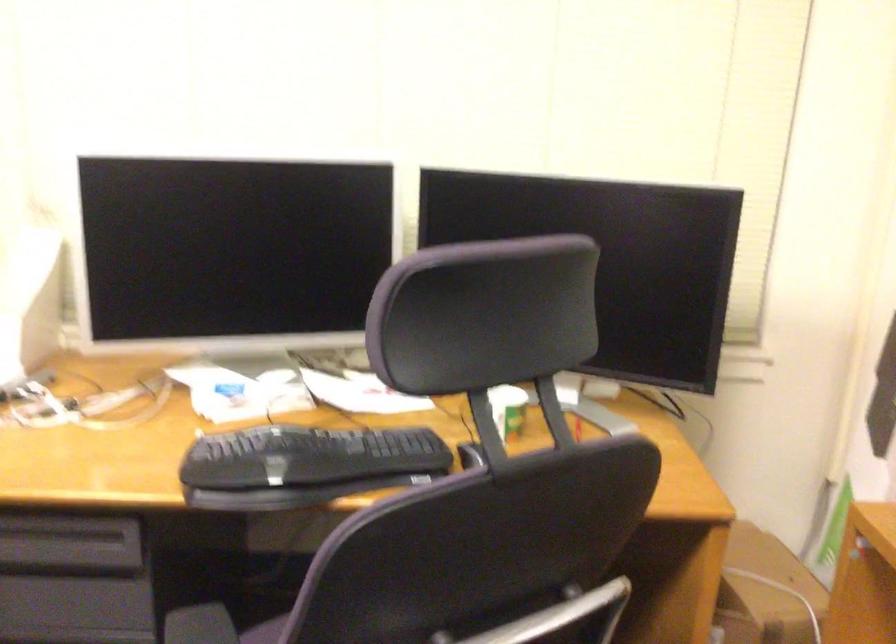
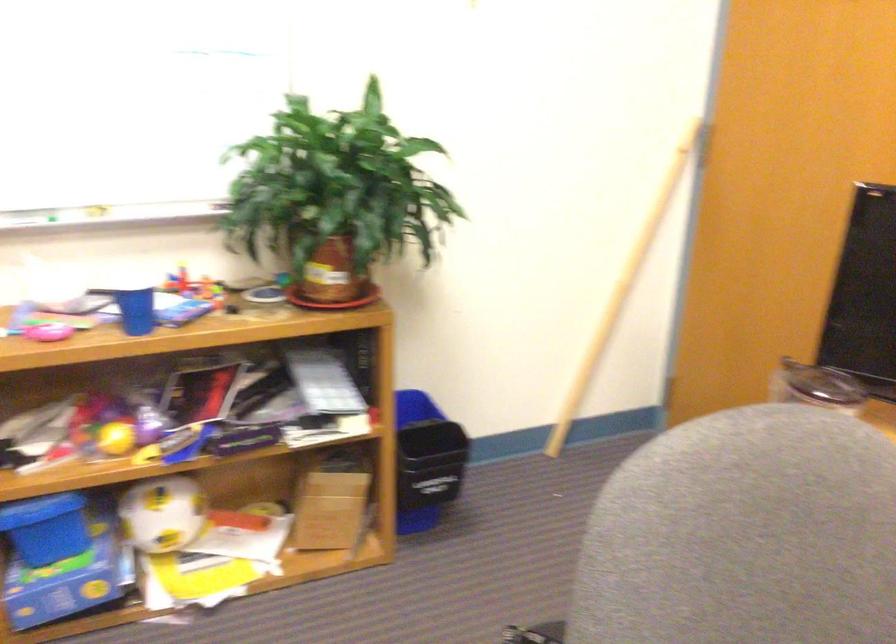
First-person continuous shooting, in which direction is the camera rotating?

The rotation direction of the camera is right-down.